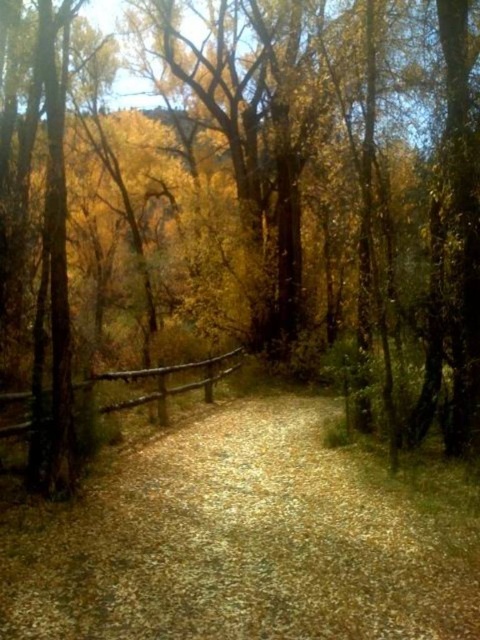
You are a hiker carrying a backpack and need to cross the path. The gravelly dirt path at center is 2.89 meters from brown wooden fence at left. Can you safely walk between them without touching the fence?

The gravelly dirt path at center is 2.89 meters from the brown wooden fence at left. Since the distance between them is sufficient for a person to walk through comfortably, you can safely walk between them without touching the fence.